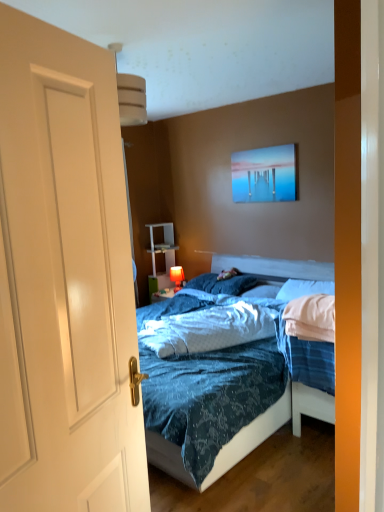
Question: Is white soft pillow at center, the 2th pillow when ordered from right to left, wider or thinner than white glossy door at center?

Choices:
 (A) wide
 (B) thin

Answer: (A)

Question: Considering the positions of point (276, 288) and point (100, 76), is point (276, 288) closer or farther from the camera than point (100, 76)?

Choices:
 (A) closer
 (B) farther

Answer: (B)

Question: Based on their relative distances, which object is farther from the blue soft pillow at center, the first pillow positioned from the left?

Choices:
 (A) white glossy door at center
 (B) white glossy shelf at center
 (C) matte red lamp at center
 (D) metallic glossy picture frame at upper center
 (E) white soft pillow at center, marked as the second pillow in a left-to-right arrangement

Answer: (A)

Question: Which is farther from the matte red lamp at center?

Choices:
 (A) white glossy shelf at center
 (B) blue soft pillow at center, the first pillow positioned from the left
 (C) white soft pillow at center, the 2th pillow when ordered from right to left
 (D) white glossy door at center
 (E) metallic glossy picture frame at upper center

Answer: (D)